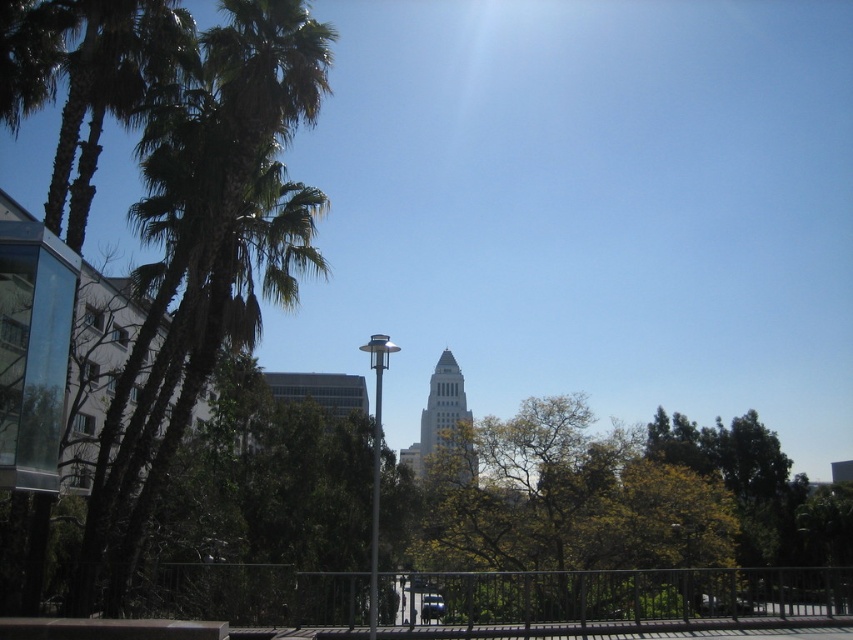
Is green leafy palm tree at left in front of sleek metallic pole at center?

No, green leafy palm tree at left is further to the viewer.

Which is more to the right, green leafy palm tree at left or sleek metallic pole at center?

Positioned to the right is sleek metallic pole at center.

Which is behind, point (259, 236) or point (376, 554)?

The point (259, 236) is more distant.

Locate an element on the screen. This screenshot has height=640, width=853. green leafy palm tree at left is located at coordinates (204, 252).

Does point (625, 513) come closer to viewer compared to point (425, 604)?

That is False.

The height and width of the screenshot is (640, 853). Identify the location of green leafy tree at center. (567, 499).

Is green leafy palm tree at left shorter than metallic silver pole at center?

In fact, green leafy palm tree at left may be taller than metallic silver pole at center.

Locate an element on the screen. green leafy palm tree at left is located at coordinates (204, 252).